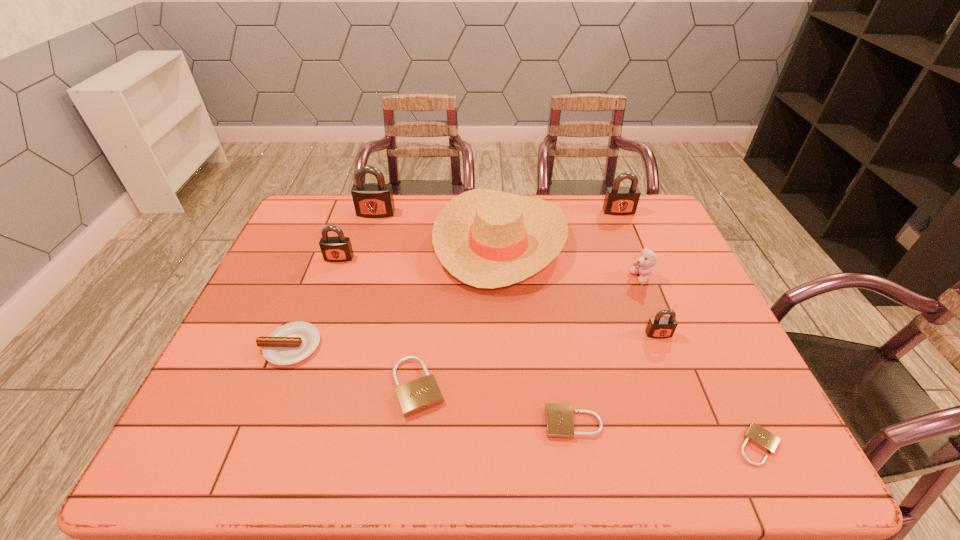
Find the location of a particular element. padlock present at the left edge is located at coordinates (338, 248).

The image size is (960, 540). I want to click on sausage at the left edge, so click(x=293, y=342).

The image size is (960, 540). I want to click on teddy bear that is positioned at the right edge, so click(643, 266).

At what (x,y) coordinates should I click in order to perform the action: click on object at the far right corner. Please return your answer as a coordinate pair (x, y). The image size is (960, 540). Looking at the image, I should click on (620, 201).

At what (x,y) coordinates should I click in order to perform the action: click on object that is at the near right corner. Please return your answer as a coordinate pair (x, y). Looking at the image, I should click on (760, 437).

This screenshot has height=540, width=960. I want to click on vacant space at the near edge of the desktop, so click(514, 452).

Find the location of a particular element. vacant space at the left edge of the desktop is located at coordinates (305, 273).

Identify the location of vacant space at the right edge of the desktop. This screenshot has height=540, width=960. (658, 240).

The width and height of the screenshot is (960, 540). Identify the location of free space between the shortest object and the sixth shortest padlock. (688, 328).

What are the coordinates of `free space between the teddy bear and the shortest object` in the screenshot? It's located at (699, 362).